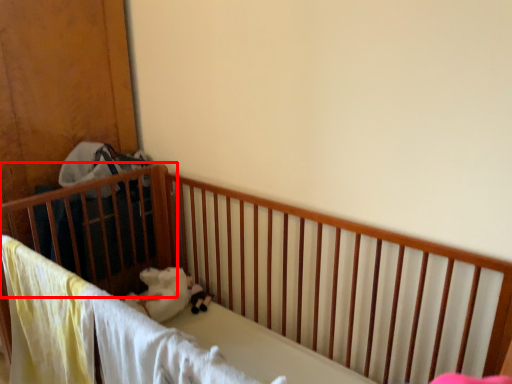
Question: Where is infant bed (annotated by the red box) located in relation to toy in the image?

Choices:
 (A) left
 (B) right

Answer: (A)